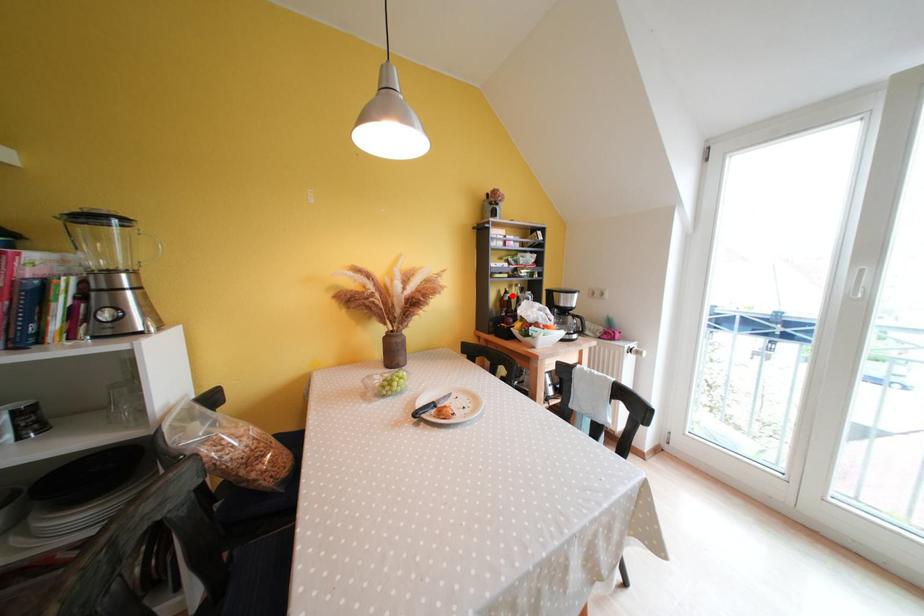
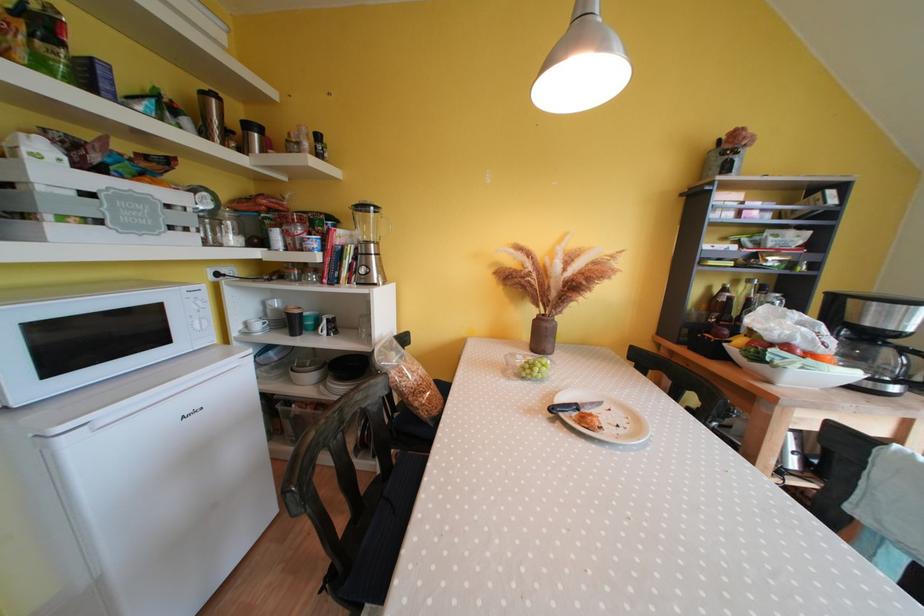
Where in the second image is the point corresponding to the highlighted location from the first image?

(731, 294)